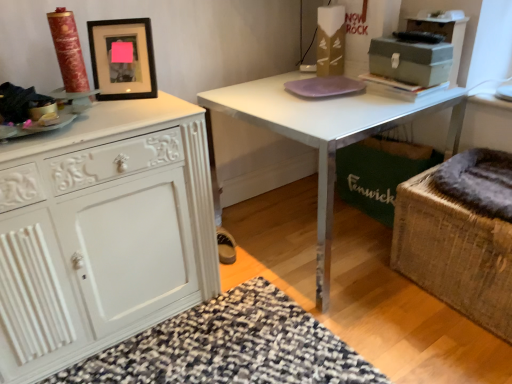
Question: From the image's perspective, is white painted wood cabinet at left located above or below black matte picture frame at upper left?

Choices:
 (A) above
 (B) below

Answer: (B)

Question: Based on their sizes in the image, would you say white painted wood cabinet at left is bigger or smaller than black matte picture frame at upper left?

Choices:
 (A) small
 (B) big

Answer: (B)

Question: Which is nearer to the white glossy table at center?

Choices:
 (A) white painted wood cabinet at left
 (B) dark gray plush at right, which ranks as the 1th swivel chair in top-to-bottom order
 (C) metallic gray cabinet at upper right
 (D) purple glass plate at center
 (E) matte gray metal box at upper right

Answer: (D)

Question: Considering the real-world distances, which object is farthest from the white glossy table at center?

Choices:
 (A) matte gray metal box at upper right
 (B) purple glass plate at center
 (C) white painted wood cabinet at left
 (D) rattan wicker swivel chair at lower right, marked as the second swivel chair in a top-to-bottom arrangement
 (E) metallic gray cabinet at upper right

Answer: (C)